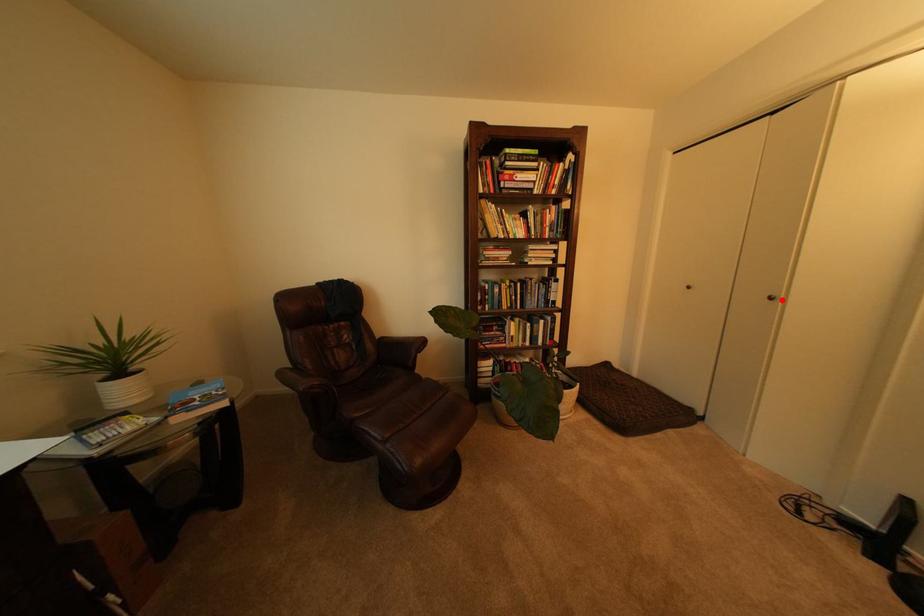
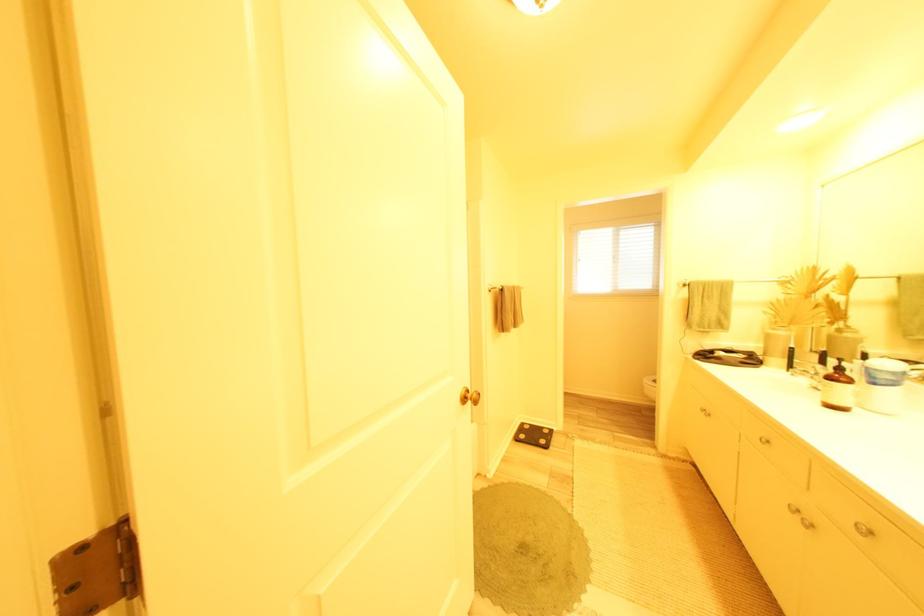
Question: I am providing you with two images of the same scene from different viewpoints. A red point is marked on the first image. At the location where the point appears in image 1, is it still visible in image 2?

Choices:
 (A) Yes
 (B) No

Answer: (B)